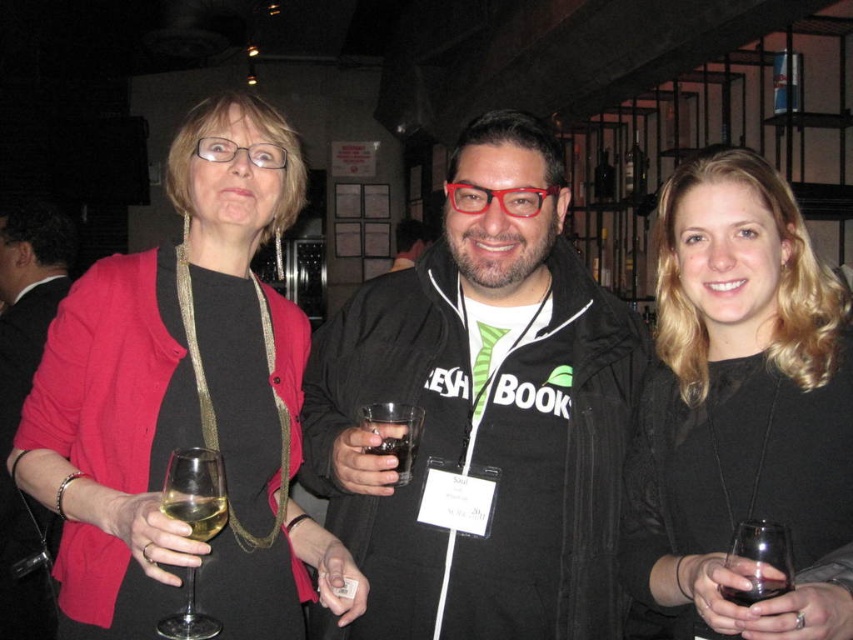
Does point (257, 204) come behind point (183, 492)?

Yes, it is behind point (183, 492).

Who is lower down, matte black jacket at left or translucent glass at lower left?

translucent glass at lower left is below.

What do you see at coordinates (184, 404) in the screenshot?
I see `matte black jacket at left` at bounding box center [184, 404].

Identify the location of matte black jacket at left. (184, 404).

Between point (627, 538) and point (735, 595), which one is positioned behind?

Positioned behind is point (627, 538).

This screenshot has height=640, width=853. I want to click on black matte dress at center, so click(x=741, y=412).

Where is `black matte dress at center`? This screenshot has height=640, width=853. black matte dress at center is located at coordinates (741, 412).

Is matte black jacket at left to the left of black fabric jacket at center from the viewer's perspective?

In fact, matte black jacket at left is to the right of black fabric jacket at center.

Between matte black jacket at left and black fabric jacket at center, which one appears on the right side from the viewer's perspective?

Positioned to the right is matte black jacket at left.

In order to click on matte black jacket at left in this screenshot , I will do `click(184, 404)`.